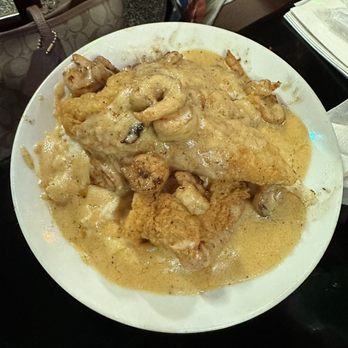
This screenshot has height=348, width=348. I want to click on napkin, so click(x=338, y=127).